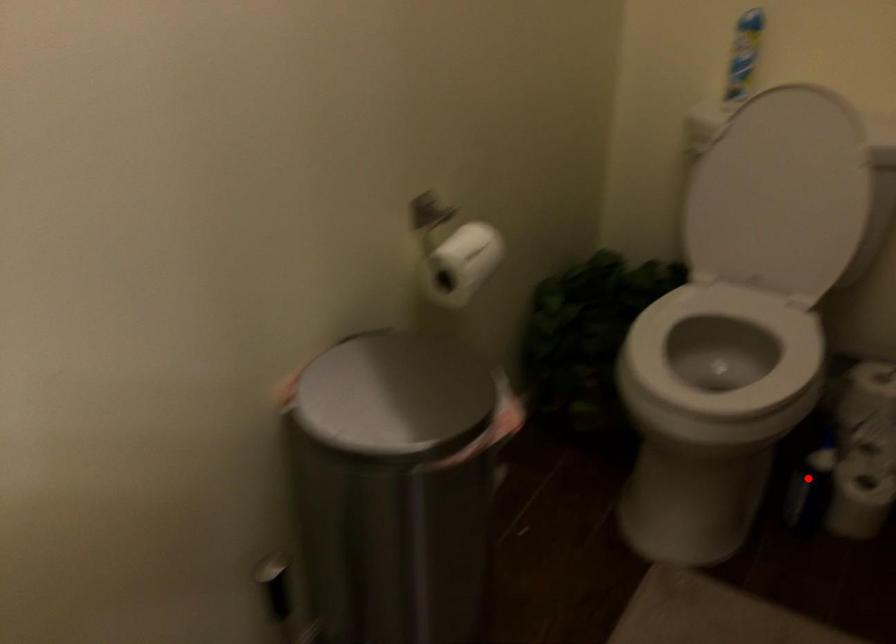
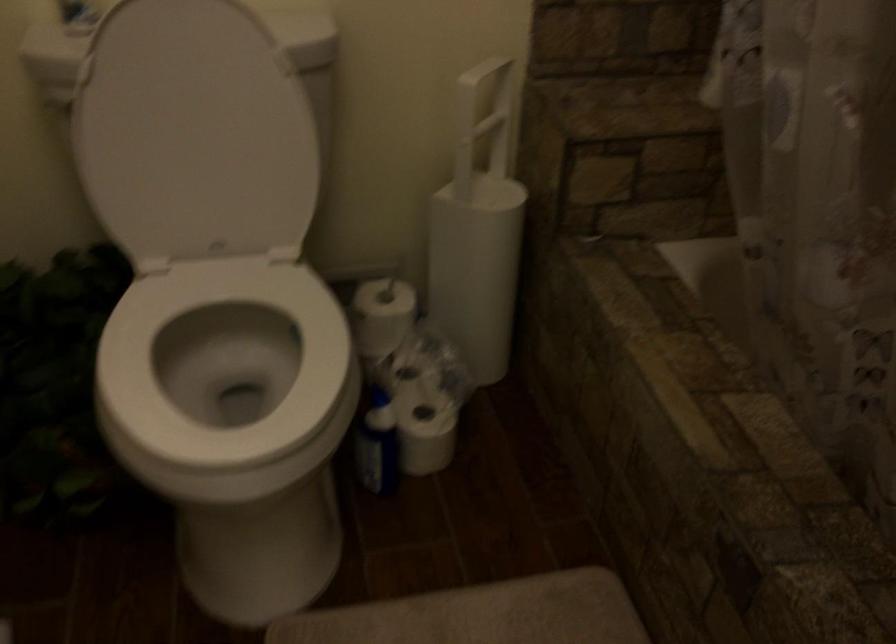
Locate, in the second image, the point that corresponds to the highlighted location in the first image.

(375, 442)